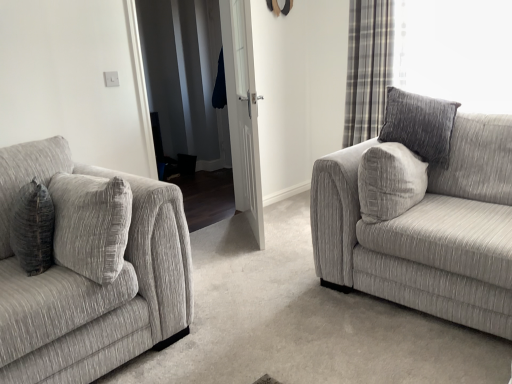
Question: Is white glossy door at center to the left or to the right of plaid fabric curtain at upper right in the image?

Choices:
 (A) left
 (B) right

Answer: (A)

Question: From a real-world perspective, is white glossy door at center above or below plaid fabric curtain at upper right?

Choices:
 (A) below
 (B) above

Answer: (A)

Question: Considering the real-world distances, which object is farthest from the textured gray couch at left, acting as the 2th studio couch starting from the right?

Choices:
 (A) white glossy door at center
 (B) textured gray couch at right, marked as the 2th studio couch in a left-to-right arrangement
 (C) plaid fabric curtain at upper right

Answer: (C)

Question: Based on their relative distances, which object is nearer to the plaid fabric curtain at upper right?

Choices:
 (A) white glossy door at center
 (B) textured gray couch at left, which is counted as the first studio couch, starting from the left
 (C) textured gray couch at right, marked as the 2th studio couch in a left-to-right arrangement

Answer: (A)